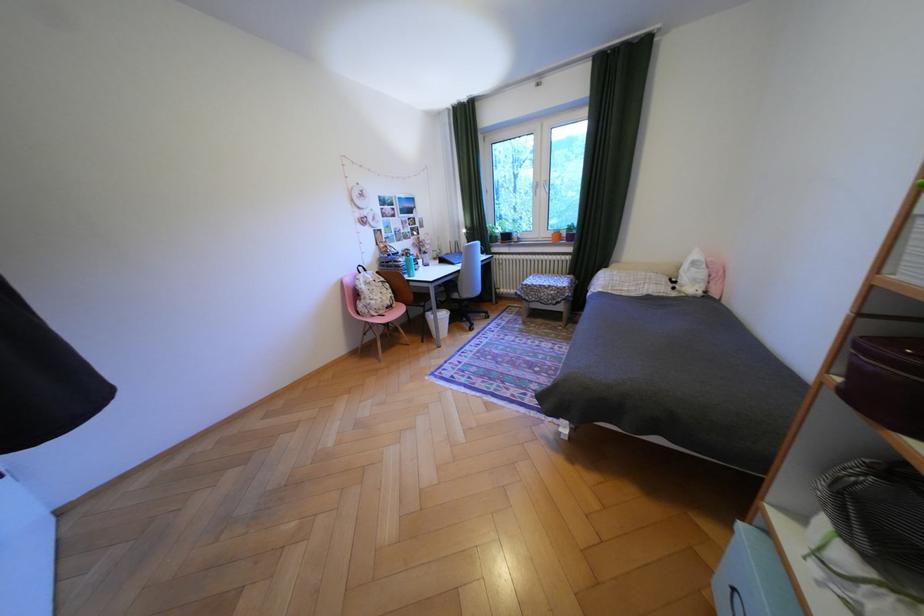
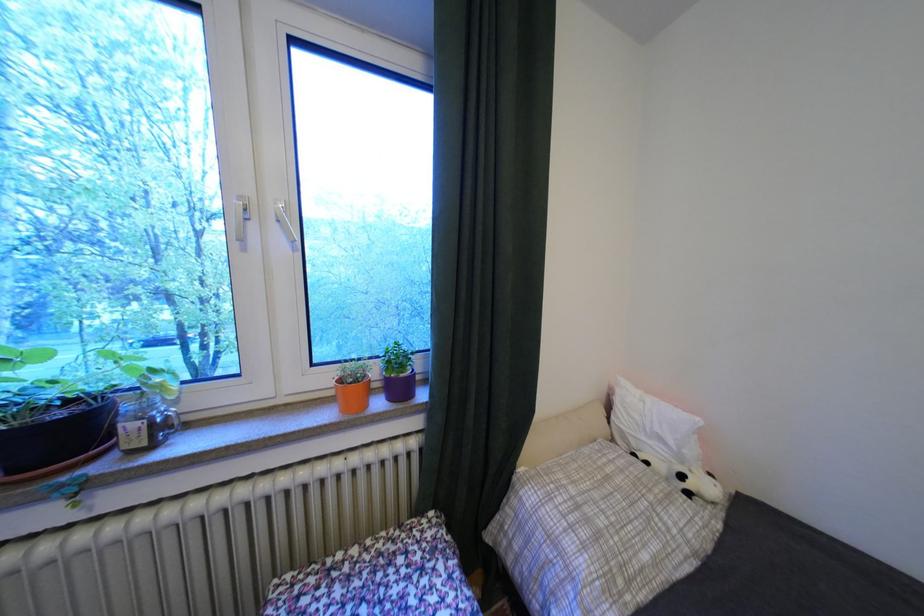
In the second image, find the point that corresponds to point (518, 238) in the first image.

(75, 436)